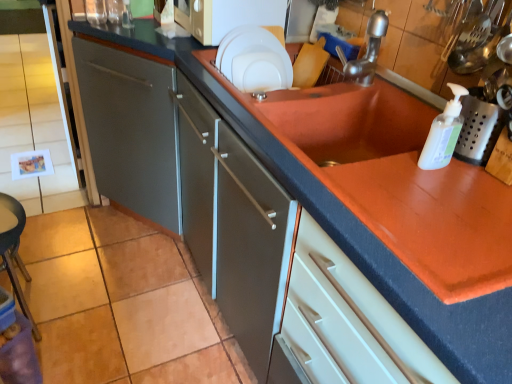
Question: Is silver metallic faucet at upper right to the left of white glossy plate at upper center from the viewer's perspective?

Choices:
 (A) no
 (B) yes

Answer: (A)

Question: Can you confirm if silver metallic faucet at upper right is bigger than white glossy plate at upper center?

Choices:
 (A) yes
 (B) no

Answer: (B)

Question: Is silver metallic faucet at upper right positioned with its back to white glossy plate at upper center?

Choices:
 (A) yes
 (B) no

Answer: (B)

Question: From a real-world perspective, is silver metallic faucet at upper right physically below white glossy plate at upper center?

Choices:
 (A) yes
 (B) no

Answer: (B)

Question: Is silver metallic faucet at upper right positioned before white glossy plate at upper center?

Choices:
 (A) yes
 (B) no

Answer: (A)

Question: Could you tell me if silver metallic faucet at upper right is turned towards white glossy plate at upper center?

Choices:
 (A) yes
 (B) no

Answer: (B)

Question: Is silver metallic faucet at upper right outside of white matte microwave at upper center?

Choices:
 (A) yes
 (B) no

Answer: (A)

Question: Is silver metallic faucet at upper right at the right side of white matte microwave at upper center?

Choices:
 (A) yes
 (B) no

Answer: (A)

Question: Does silver metallic faucet at upper right have a smaller size compared to white matte microwave at upper center?

Choices:
 (A) yes
 (B) no

Answer: (A)

Question: Can you confirm if silver metallic faucet at upper right is thinner than white matte microwave at upper center?

Choices:
 (A) yes
 (B) no

Answer: (A)

Question: From the image's perspective, would you say silver metallic faucet at upper right is positioned over white matte microwave at upper center?

Choices:
 (A) no
 (B) yes

Answer: (A)

Question: Does silver metallic faucet at upper right lie behind white matte microwave at upper center?

Choices:
 (A) yes
 (B) no

Answer: (B)

Question: Does white matte microwave at upper center have a lesser height compared to white glossy plate at upper center?

Choices:
 (A) no
 (B) yes

Answer: (B)